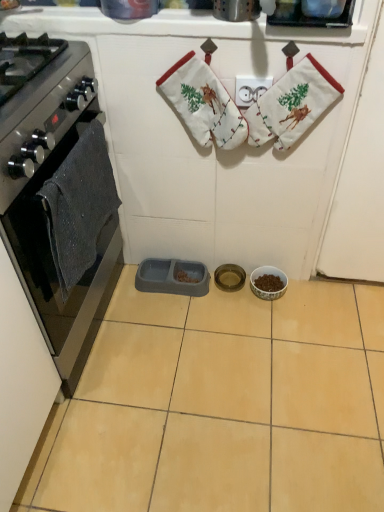
This screenshot has height=512, width=384. In order to click on empty space that is to the right of porcelain bowl at center, the third appliance in the left-to-right sequence in this screenshot , I will do (316, 296).